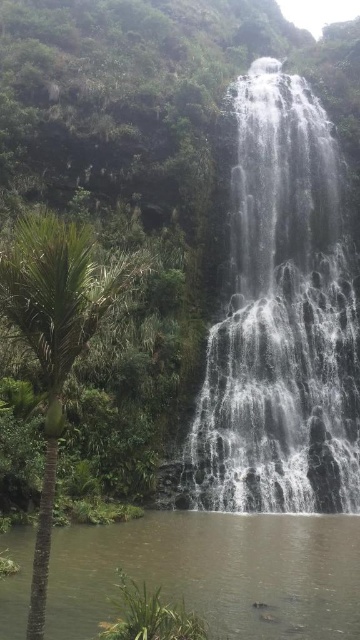
Based on the photo, is translucent glass waterfall at center to the left of brown smooth water at bottom from the viewer's perspective?

In fact, translucent glass waterfall at center is to the right of brown smooth water at bottom.

Is point (275, 115) in front of point (65, 586)?

No, (275, 115) is behind (65, 586).

Locate an element on the screen. translucent glass waterfall at center is located at coordinates (280, 321).

Which is above, brown smooth water at bottom or green leafy palm tree at left?

green leafy palm tree at left is higher up.

Is brown smooth water at bottom to the right of green leafy palm tree at left from the viewer's perspective?

Yes, brown smooth water at bottom is to the right of green leafy palm tree at left.

This screenshot has width=360, height=640. Describe the element at coordinates (214, 572) in the screenshot. I see `brown smooth water at bottom` at that location.

I want to click on brown smooth water at bottom, so click(214, 572).

Can you confirm if translucent glass waterfall at center is positioned above green leafy palm tree at left?

Yes, translucent glass waterfall at center is above green leafy palm tree at left.

Does point (222, 413) come behind point (91, 246)?

Yes, it is.

Who is more forward, [267,160] or [51,381]?

Point [51,381] is more forward.

The height and width of the screenshot is (640, 360). I want to click on translucent glass waterfall at center, so click(x=280, y=321).